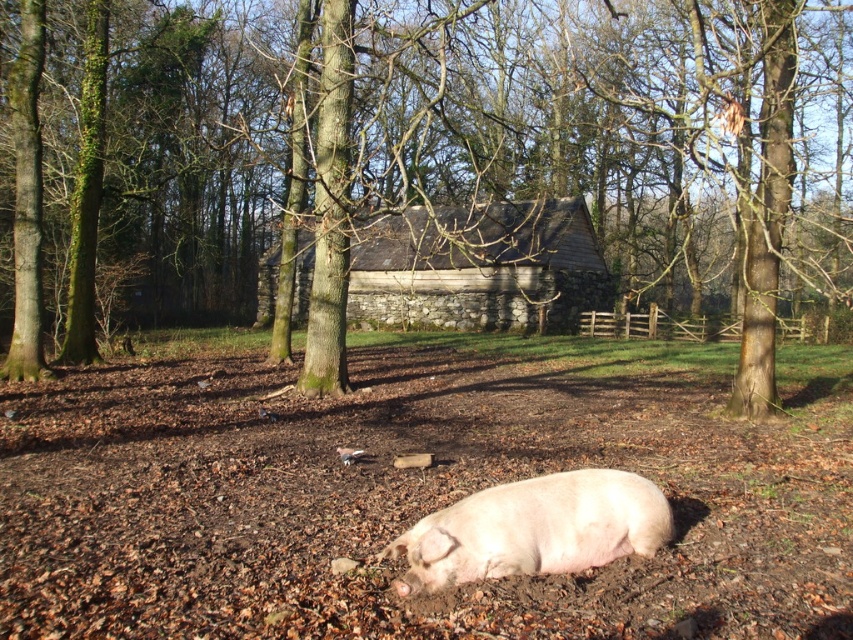
You are a photographer taking pictures of the pink smooth pig at lower center. You want to ensure the brown textured tree at center is visible in the background. Is the tree tall enough to be seen behind the pig?

The brown textured tree at center is taller than the pink smooth pig at lower center, so yes, the tree will be visible behind the pig in the photo.